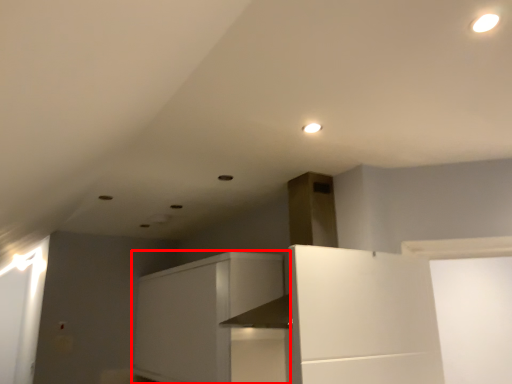
Question: From the image's perspective, what is the correct spatial relationship of cabinetry (annotated by the red box) in relation to lighting?

Choices:
 (A) above
 (B) below

Answer: (B)